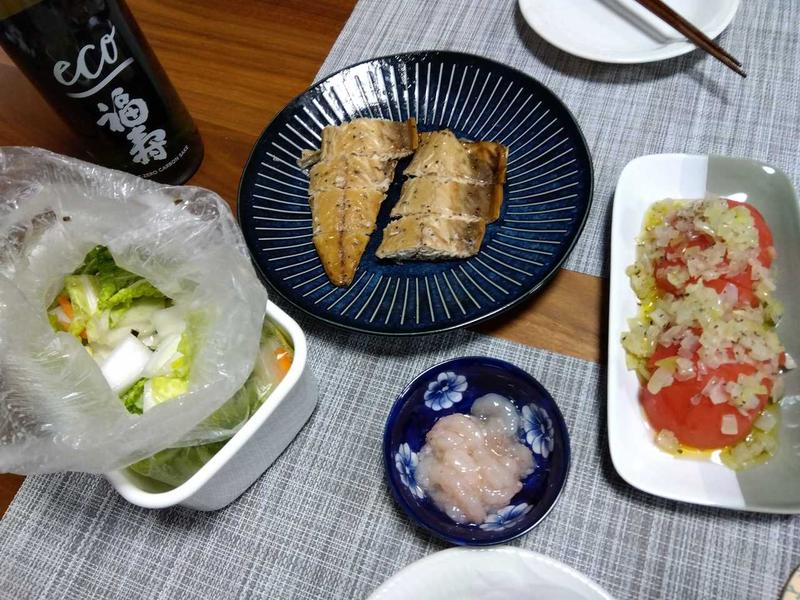
Find the location of a particular element. The width and height of the screenshot is (800, 600). bowl is located at coordinates (406, 481).